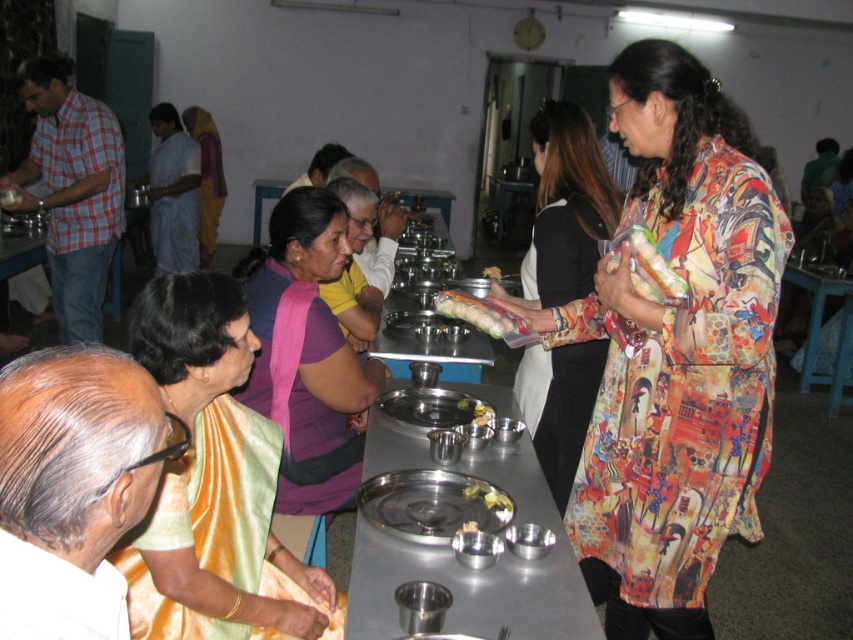
Is point (42, 161) farther from camera compared to point (502, 276)?

Yes, it is.

Does plaid cotton shirt at left have a larger size compared to white matte rice at center?

Indeed, plaid cotton shirt at left has a larger size compared to white matte rice at center.

The image size is (853, 640). Identify the location of plaid cotton shirt at left. (71, 192).

Is printed fabric scarf at center bigger than printed fabric dress at center?

Yes, printed fabric scarf at center is bigger than printed fabric dress at center.

Where is `printed fabric scarf at center`? Image resolution: width=853 pixels, height=640 pixels. printed fabric scarf at center is located at coordinates (676, 352).

Is plaid cotton shirt at left below white textured bread at center?

No.

Is plaid cotton shirt at left to the left of white textured bread at center from the viewer's perspective?

Indeed, plaid cotton shirt at left is positioned on the left side of white textured bread at center.

This screenshot has height=640, width=853. I want to click on plaid cotton shirt at left, so click(x=71, y=192).